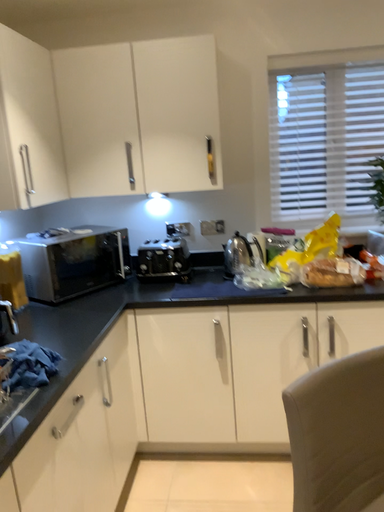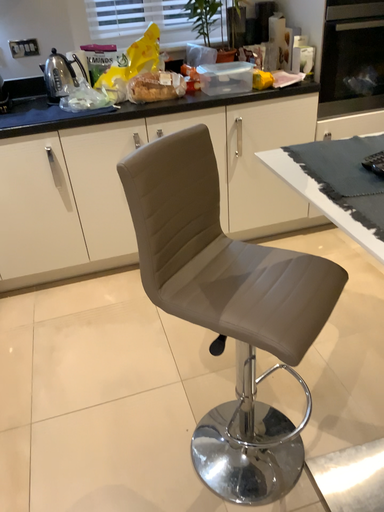
Question: How did the camera likely rotate when shooting the video?

Choices:
 (A) rotated right
 (B) rotated left

Answer: (A)